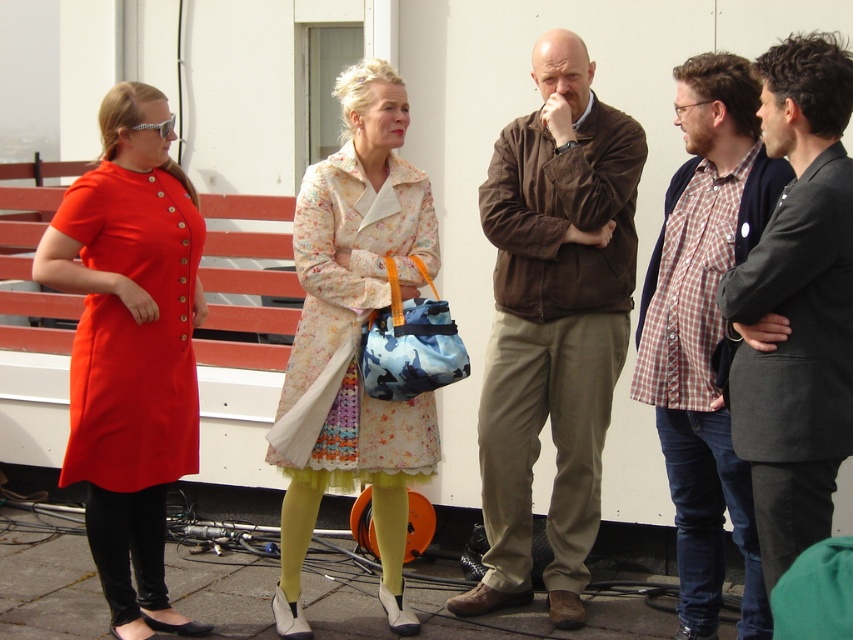
You are taking a photo of the group on the rooftop. You want to focus on the two specific points in the image, point (169, 294) and point (775, 520). Which point is closer to your camera?

Point (169, 294) is closer to the camera than point (775, 520).